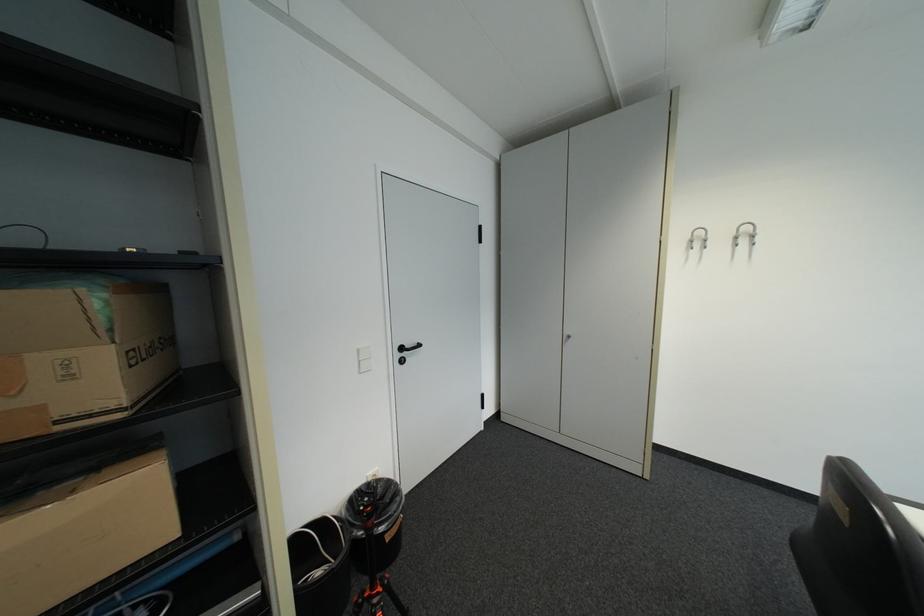
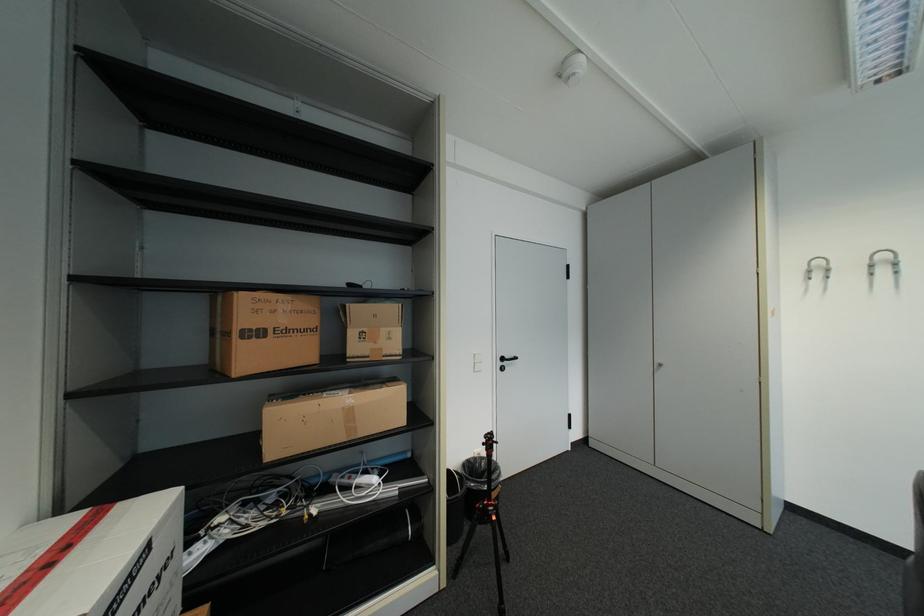
Question: Based on the continuous images, in which direction is the camera rotating? Reply with the corresponding letter.

Choices:
 (A) Left
 (B) Right
 (C) Up
 (D) Down

Answer: (A)